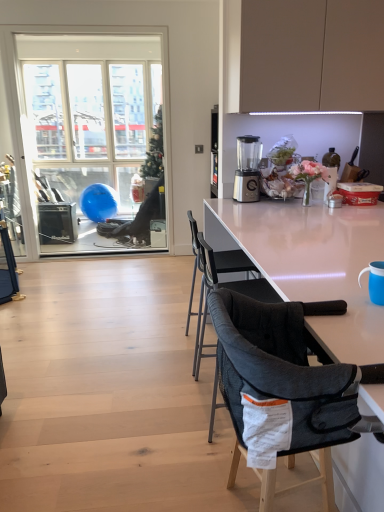
Question: Is white glossy table at center with clear glass window at left?

Choices:
 (A) no
 (B) yes

Answer: (A)

Question: Considering the relative positions of white glossy table at center and clear glass window at left in the image provided, is white glossy table at center to the right of clear glass window at left from the viewer's perspective?

Choices:
 (A) no
 (B) yes

Answer: (B)

Question: Is white glossy table at center facing towards clear glass window at left?

Choices:
 (A) yes
 (B) no

Answer: (B)

Question: Does white glossy table at center have a lesser height compared to clear glass window at left?

Choices:
 (A) yes
 (B) no

Answer: (A)

Question: Is white glossy table at center thinner than clear glass window at left?

Choices:
 (A) no
 (B) yes

Answer: (A)

Question: Considering the positions of point (246, 259) and point (218, 323), is point (246, 259) closer or farther from the camera than point (218, 323)?

Choices:
 (A) closer
 (B) farther

Answer: (B)

Question: Is dark gray fabric chair at center, the first chair from the back, taller or shorter than dark gray mesh chair at center, the 1th chair viewed from the front?

Choices:
 (A) short
 (B) tall

Answer: (B)

Question: Do you think dark gray fabric chair at center, the first chair from the back, is within dark gray mesh chair at center, the second chair viewed from the back, or outside of it?

Choices:
 (A) inside
 (B) outside

Answer: (B)

Question: Considering the positions of dark gray fabric chair at center, the first chair from the back, and dark gray mesh chair at center, the 1th chair viewed from the front, in the image, is dark gray fabric chair at center, the first chair from the back, wider or thinner than dark gray mesh chair at center, the 1th chair viewed from the front,?

Choices:
 (A) thin
 (B) wide

Answer: (B)

Question: Considering the relative positions of white glossy table at center and sleek silver blender at center in the image provided, is white glossy table at center to the left or to the right of sleek silver blender at center?

Choices:
 (A) left
 (B) right

Answer: (B)

Question: From the image's perspective, relative to sleek silver blender at center, is white glossy table at center above or below?

Choices:
 (A) above
 (B) below

Answer: (B)

Question: In the image, is white glossy table at center positioned in front of or behind sleek silver blender at center?

Choices:
 (A) front
 (B) behind

Answer: (A)

Question: From a real-world perspective, is white glossy table at center physically located above or below sleek silver blender at center?

Choices:
 (A) above
 (B) below

Answer: (B)

Question: From their relative heights in the image, would you say blue plastic cup at right is taller or shorter than dark gray mesh chair at center, the 1th chair viewed from the front?

Choices:
 (A) tall
 (B) short

Answer: (B)

Question: From a real-world perspective, is blue plastic cup at right positioned above or below dark gray mesh chair at center, the second chair viewed from the back?

Choices:
 (A) above
 (B) below

Answer: (A)